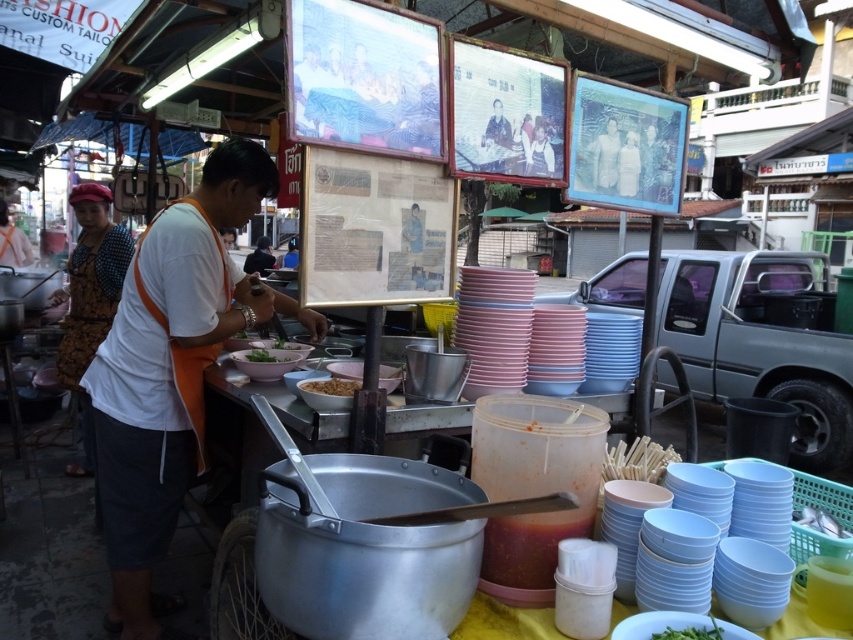
Question: Which of the following is the closest to the observer?

Choices:
 (A) brown matte food at center
 (B) green leafy vegetable at center

Answer: (A)

Question: Is green matte vegetable at lower center below white matte bowl at center?

Choices:
 (A) no
 (B) yes

Answer: (B)

Question: Based on their relative distances, which object is farther from the green leafy vegetable at center?

Choices:
 (A) patterned fabric headscarf at left
 (B) brown matte food at center
 (C) green matte vegetable at lower center

Answer: (C)

Question: Is patterned fabric headscarf at left closer to camera compared to green matte vegetable at lower center?

Choices:
 (A) yes
 (B) no

Answer: (B)

Question: Which of the following is the closest to the observer?

Choices:
 (A) green matte vegetable at lower center
 (B) brown matte food at center

Answer: (A)

Question: Is brown matte food at center below white matte bowl at center?

Choices:
 (A) yes
 (B) no

Answer: (A)